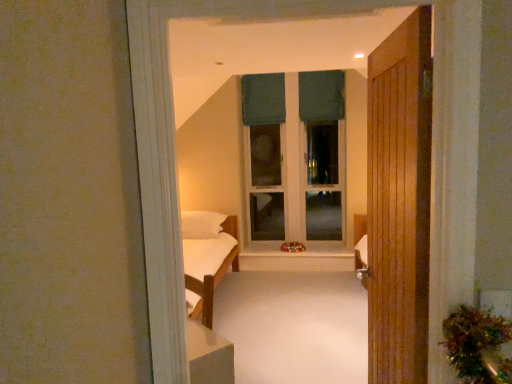
Question: Considering the positions of dark green fabric at upper center, acting as the 1th curtain starting from the right, and green fabric window frame at center in the image, is dark green fabric at upper center, acting as the 1th curtain starting from the right, taller or shorter than green fabric window frame at center?

Choices:
 (A) tall
 (B) short

Answer: (B)

Question: Considering their positions, is dark green fabric at upper center, which appears as the second curtain when viewed from the left, located in front of or behind green fabric window frame at center?

Choices:
 (A) front
 (B) behind

Answer: (B)

Question: Considering the real-world distances, which object is farthest from the green fabric window frame at center?

Choices:
 (A) white wood at center
 (B) dark green fabric at upper center, which appears as the second curtain when viewed from the left
 (C) wooden door at right
 (D) dark green fabric curtain at upper center, the second curtain in the right-to-left sequence

Answer: (C)

Question: Which object is the farthest from the white wood at center?

Choices:
 (A) green fabric window frame at center
 (B) dark green fabric at upper center, acting as the 1th curtain starting from the right
 (C) wooden door at right
 (D) dark green fabric curtain at upper center, the second curtain in the right-to-left sequence

Answer: (C)